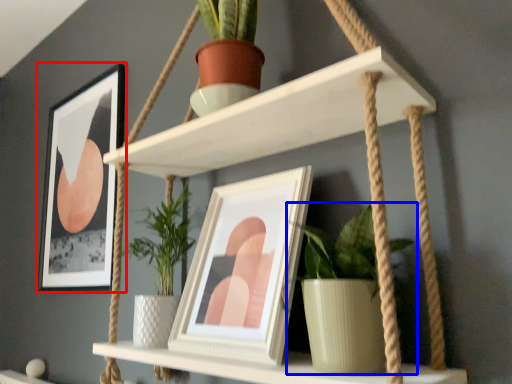
Question: Which object is closer to the camera taking this photo, picture frame (highlighted by a red box) or houseplant (highlighted by a blue box)?

Choices:
 (A) picture frame
 (B) houseplant

Answer: (B)